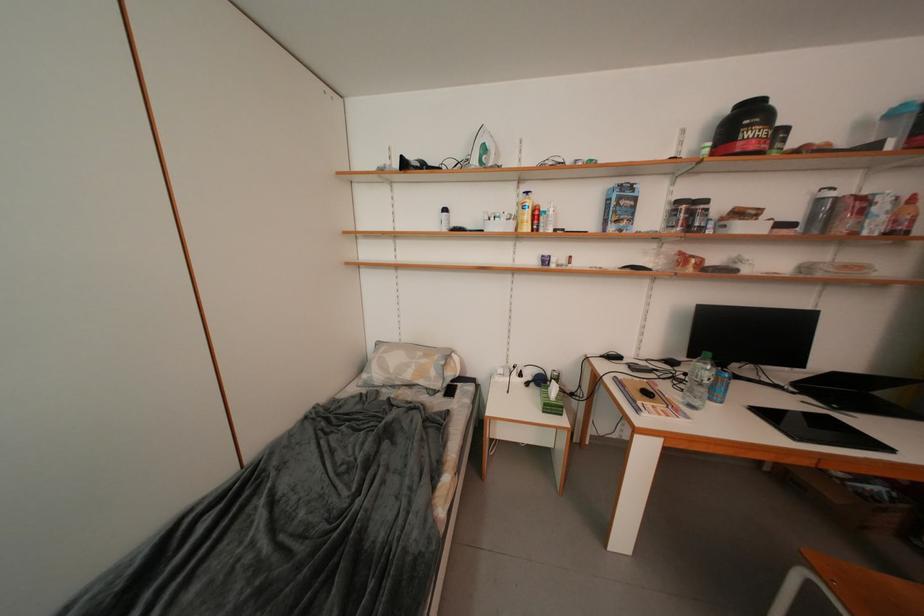
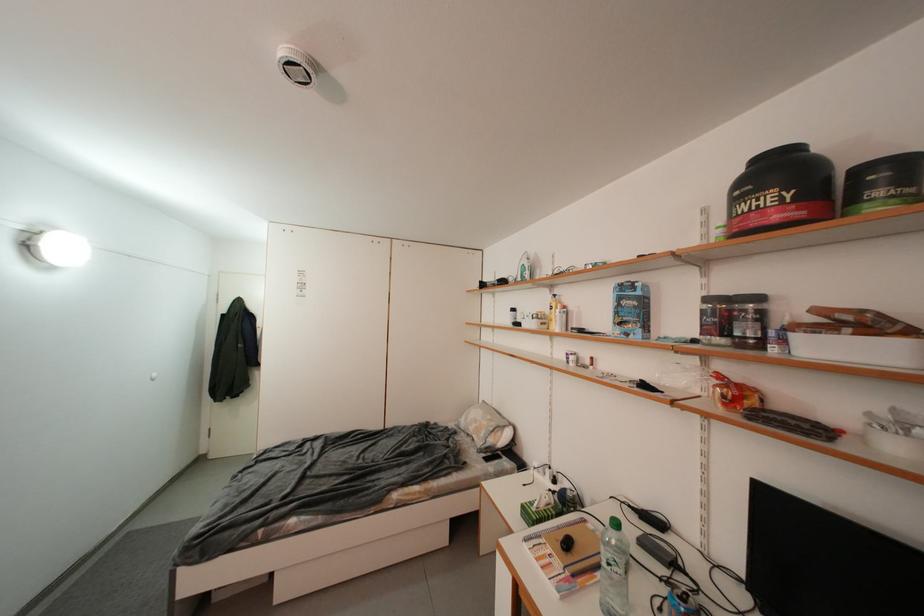
Find the pixel in the second image that matches [785,148] in the first image.

(886, 196)